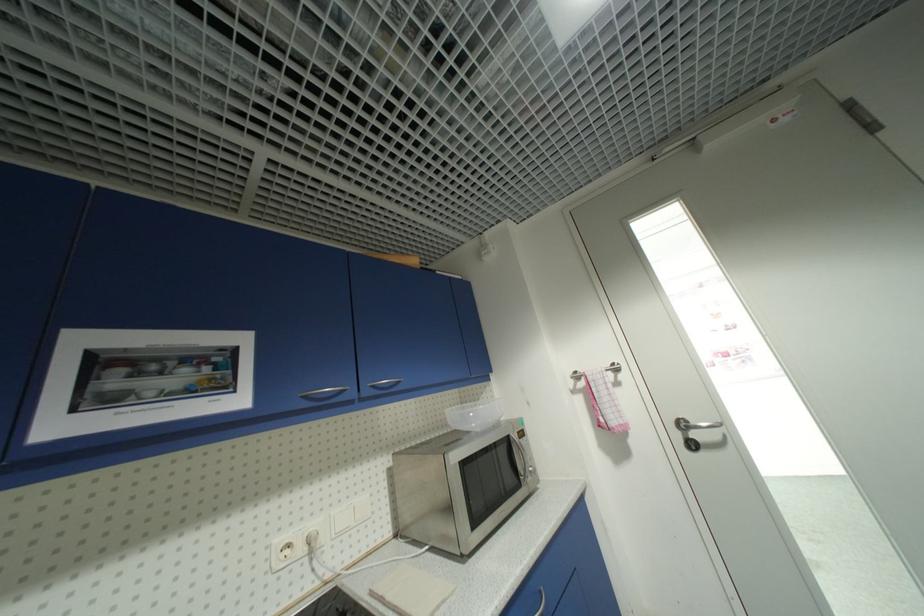
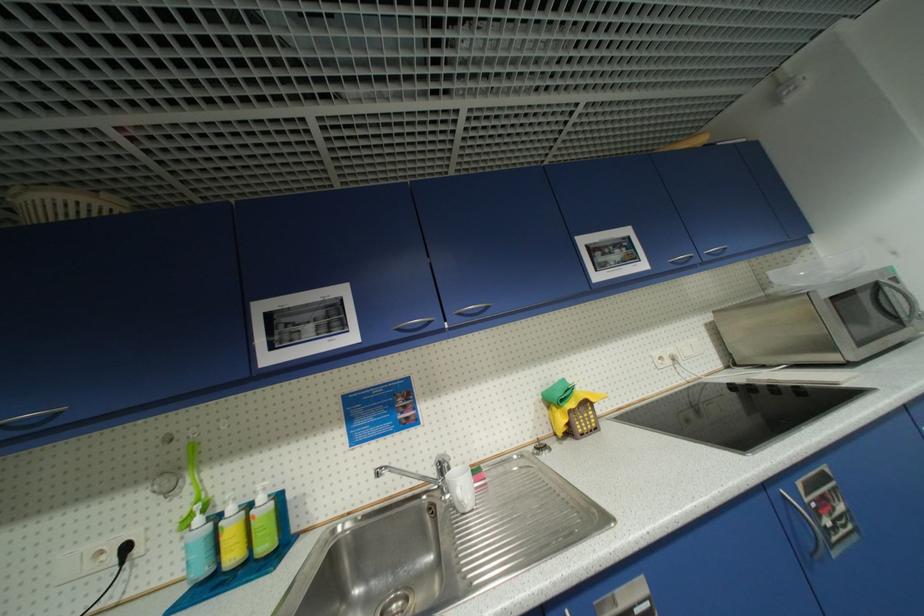
Find the pixel in the second image that matches pixel 481 399 in the first image.

(793, 265)